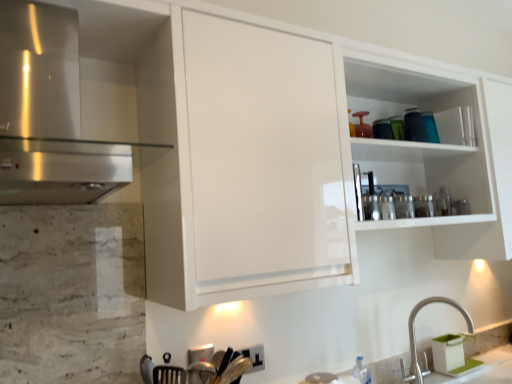
Where is `satin nickel faucet at lower right`? The height and width of the screenshot is (384, 512). satin nickel faucet at lower right is located at coordinates point(414,329).

The width and height of the screenshot is (512, 384). Describe the element at coordinates (414, 329) in the screenshot. I see `satin nickel faucet at lower right` at that location.

In order to face satin nickel faucet at lower right, should I rotate leftwards or rightwards?

You should look right and rotate roughly 22.899 degrees.

Measure the distance between point (414, 322) and camera.

5.99 feet.

What do you see at coordinates (67, 100) in the screenshot? I see `stainless steel range hood at left` at bounding box center [67, 100].

Where is `stainless steel range hood at left`? stainless steel range hood at left is located at coordinates click(67, 100).

Locate an element on the screen. This screenshot has height=384, width=512. satin nickel faucet at lower right is located at coordinates (414, 329).

Considering the positions of objects stainless steel range hood at left and satin nickel faucet at lower right in the image provided, who is more to the right, stainless steel range hood at left or satin nickel faucet at lower right?

From the viewer's perspective, satin nickel faucet at lower right appears more on the right side.

From the picture: Is stainless steel range hood at left behind satin nickel faucet at lower right?

No, it is not.

Which is in front, point (55, 52) or point (465, 311)?

The point (55, 52) is more forward.

From the image's perspective, which one is positioned lower, stainless steel range hood at left or satin nickel faucet at lower right?

satin nickel faucet at lower right is shown below in the image.

From a real-world perspective, which is physically above, stainless steel range hood at left or satin nickel faucet at lower right?

stainless steel range hood at left is physically above.

Which of these two, stainless steel range hood at left or satin nickel faucet at lower right, is thinner?

satin nickel faucet at lower right is thinner.

Considering the sizes of objects stainless steel range hood at left and satin nickel faucet at lower right in the image provided, who is shorter, stainless steel range hood at left or satin nickel faucet at lower right?

satin nickel faucet at lower right.

Is stainless steel range hood at left bigger than satin nickel faucet at lower right?

Yes.

Which is correct: stainless steel range hood at left is inside satin nickel faucet at lower right, or outside of it?

stainless steel range hood at left cannot be found inside satin nickel faucet at lower right.

Is stainless steel range hood at left placed right next to satin nickel faucet at lower right?

No.

Is stainless steel range hood at left positioned with its back to satin nickel faucet at lower right?

No.

How much distance is there between stainless steel range hood at left and satin nickel faucet at lower right?

stainless steel range hood at left is 5.05 feet from satin nickel faucet at lower right.

Where is `tap on the right of stainless steel range hood at left`? The height and width of the screenshot is (384, 512). tap on the right of stainless steel range hood at left is located at coordinates (414, 329).

Is satin nickel faucet at lower right at the left side of stainless steel range hood at left?

No.

Which object is further away from the camera, satin nickel faucet at lower right or stainless steel range hood at left?

satin nickel faucet at lower right is more distant.

Which is less distant, [411,353] or [68,56]?

Point [411,353].

From the image's perspective, between satin nickel faucet at lower right and stainless steel range hood at left, who is located below?

satin nickel faucet at lower right appears lower in the image.

From a real-world perspective, which object rests below the other?

satin nickel faucet at lower right, from a real-world perspective.

Considering the relative sizes of satin nickel faucet at lower right and stainless steel range hood at left in the image provided, is satin nickel faucet at lower right wider than stainless steel range hood at left?

Incorrect, the width of satin nickel faucet at lower right does not surpass that of stainless steel range hood at left.

Considering the relative sizes of satin nickel faucet at lower right and stainless steel range hood at left in the image provided, is satin nickel faucet at lower right taller than stainless steel range hood at left?

No.

In terms of size, does satin nickel faucet at lower right appear bigger or smaller than stainless steel range hood at left?

Clearly, satin nickel faucet at lower right is smaller in size than stainless steel range hood at left.

Is stainless steel range hood at left located within satin nickel faucet at lower right?

No, stainless steel range hood at left is not a part of satin nickel faucet at lower right.

Is satin nickel faucet at lower right placed right next to stainless steel range hood at left?

They are not placed beside each other.

Is satin nickel faucet at lower right positioned with its back to stainless steel range hood at left?

No, satin nickel faucet at lower right's orientation is not away from stainless steel range hood at left.

How different are the orientations of satin nickel faucet at lower right and stainless steel range hood at left in degrees?

The facing directions of satin nickel faucet at lower right and stainless steel range hood at left are 0.208 degrees apart.

How far apart are satin nickel faucet at lower right and stainless steel range hood at left?

satin nickel faucet at lower right is 5.05 feet away from stainless steel range hood at left.

Image resolution: width=512 pixels, height=384 pixels. What are the coordinates of `tap that is under the stainless steel range hood at left (from a real-world perspective)` in the screenshot? It's located at (414, 329).

At what (x,y) coordinates should I click in order to perform the action: click on cabinetry in front of the satin nickel faucet at lower right. Please return your answer as a coordinate pair (x, y). This screenshot has width=512, height=384. Looking at the image, I should click on (67, 100).

Where is `tap to the right of stainless steel range hood at left`? tap to the right of stainless steel range hood at left is located at coordinates (414, 329).